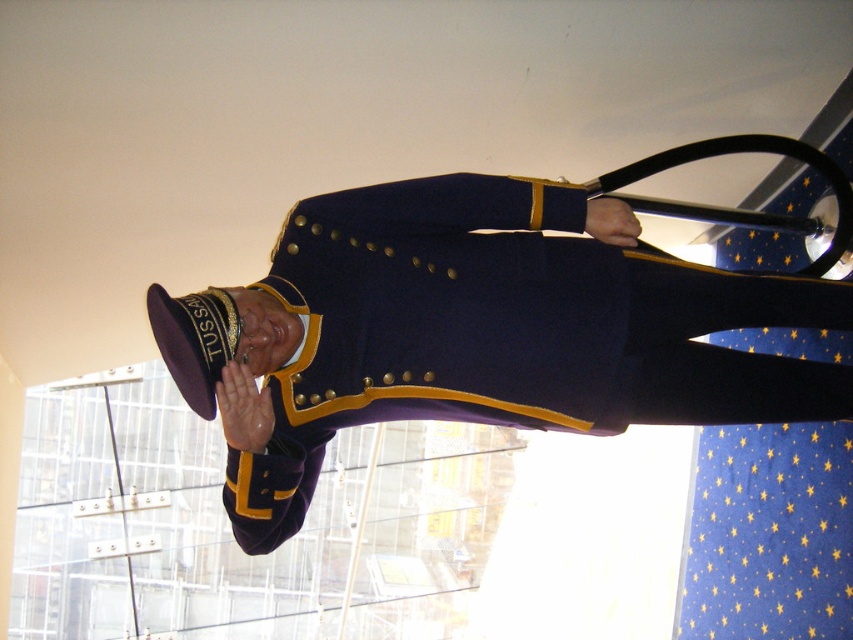
You are a tailor who needs to determine which item requires more fabric to create between the navy wool uniform at center and the maroon felt hat at center. Which one would need more fabric?

Answer: The navy wool uniform at center is bigger than the maroon felt hat at center, so it would require more fabric to create.

You are a tailor measuring a customer for a new uniform. You have the navy wool uniform at center and the maroon felt hat at center. Which item is wider?

The navy wool uniform at center is wider than the maroon felt hat at center according to the description.

You are a museum security guard who needs to ensure that the navy wool uniform at center and the maroon felt hat at center are displayed properly. According to the exhibit guidelines, the hat must not be covered by any other object. Is the current arrangement compliant with the guidelines?

The navy wool uniform at center is positioned over the maroon felt hat at center, which means the hat is covered by the uniform. This arrangement does not comply with the exhibit guidelines requiring the hat to remain uncovered.